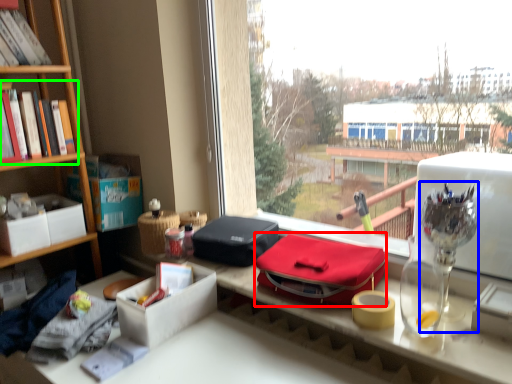
Question: Considering the real-world distances, which object is farthest from lunch box (highlighted by a red box)? glass vase (highlighted by a blue box) or book (highlighted by a green box)?

Choices:
 (A) glass vase
 (B) book

Answer: (B)